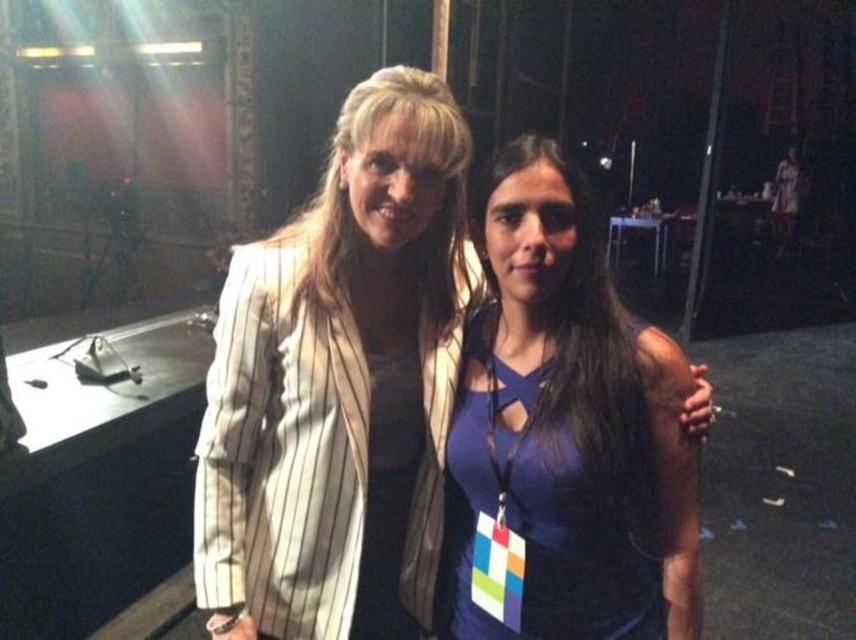
Question: Does white pinstriped blazer at center have a greater width compared to purple matte dress at center?

Choices:
 (A) no
 (B) yes

Answer: (B)

Question: Which of the following is the closest to the observer?

Choices:
 (A) white pinstriped blazer at center
 (B) purple matte dress at center

Answer: (B)

Question: Can you confirm if white pinstriped blazer at center is thinner than purple matte dress at center?

Choices:
 (A) yes
 (B) no

Answer: (B)

Question: Is white pinstriped blazer at center above purple matte dress at center?

Choices:
 (A) no
 (B) yes

Answer: (B)